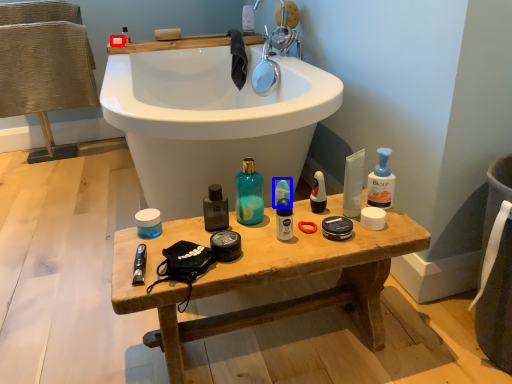
Question: Which object appears closest to the camera in this image, soap (highlighted by a red box) or toiletry (highlighted by a blue box)?

Choices:
 (A) soap
 (B) toiletry

Answer: (B)